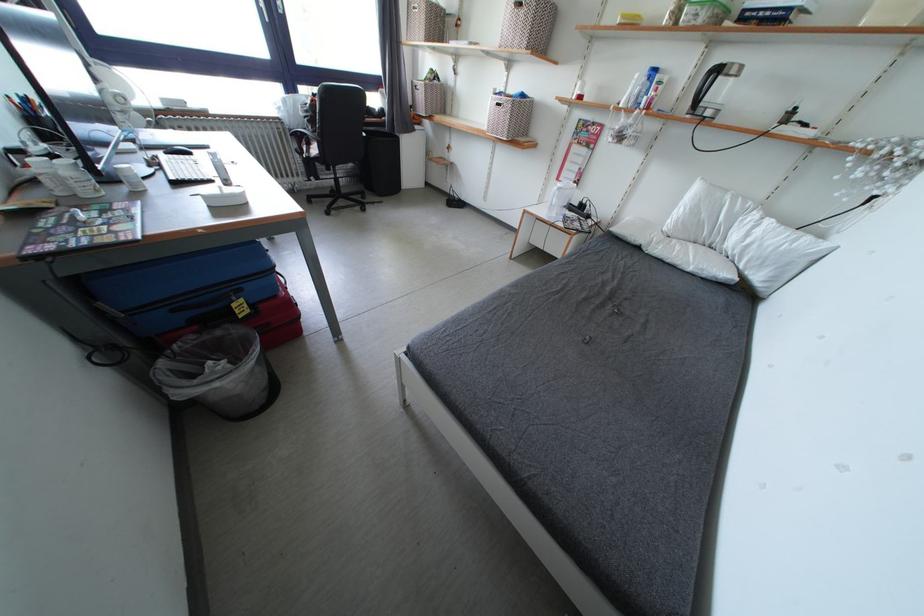
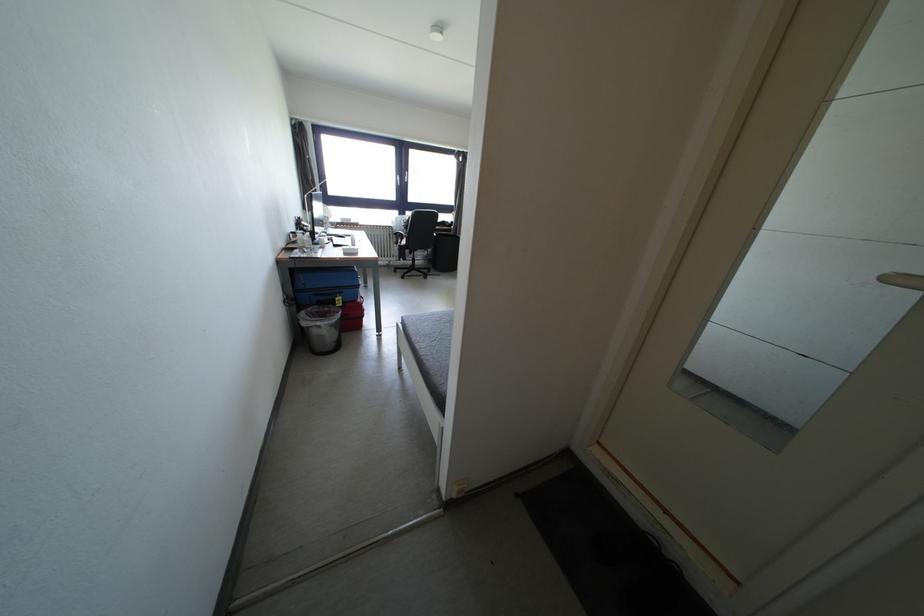
The point at (406, 363) is marked in the first image. Where is the corresponding point in the second image?

(403, 330)